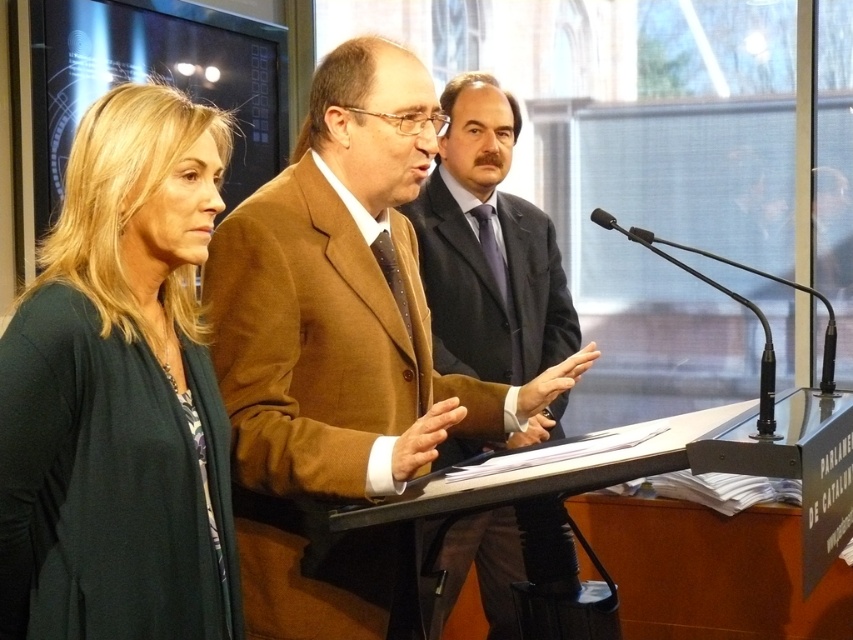
You are an event organizer who needs to adjust the lighting for a presentation. You want to ensure that the dark green sweater at left and the black plastic microphone at center are both clearly visible. Which object should you focus the spotlight on first to account for their size difference?

The dark green sweater at left has a greater height compared to the black plastic microphone at center, so you should focus the spotlight on the dark green sweater at left first since it is taller and requires more lighting coverage.

In the scene shown: You are attending a conference and need to approach the speaker. There are two people in front of you. One is wearing a brown woolen suit at center and the other is wearing a dark green sweater at left. Which person should you go around to reach the speaker?

The dark green sweater at left is behind brown woolen suit at center, so you should go around the brown woolen suit at center to reach the speaker.